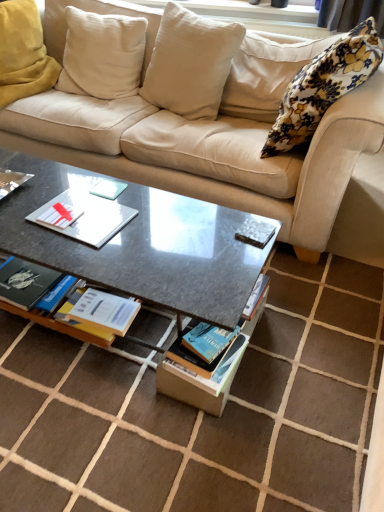
In order to click on vacant space to the right of metallic silver book at left, placed as the first book when sorted from top to bottom in this screenshot , I will do `click(47, 188)`.